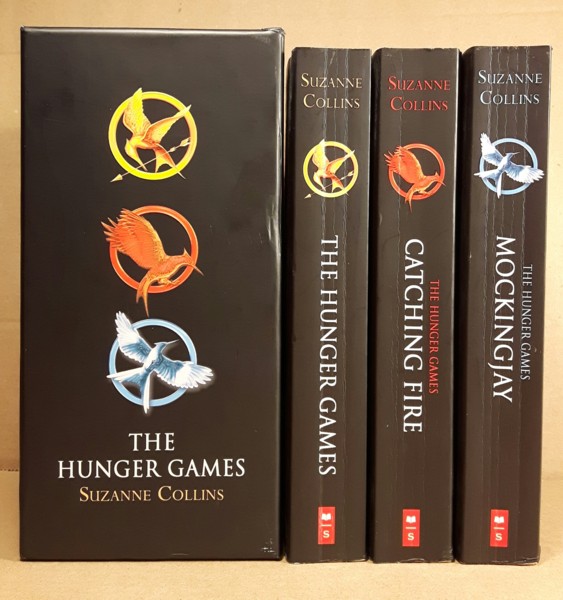
Identify the location of books. This screenshot has width=563, height=600. (254, 114).